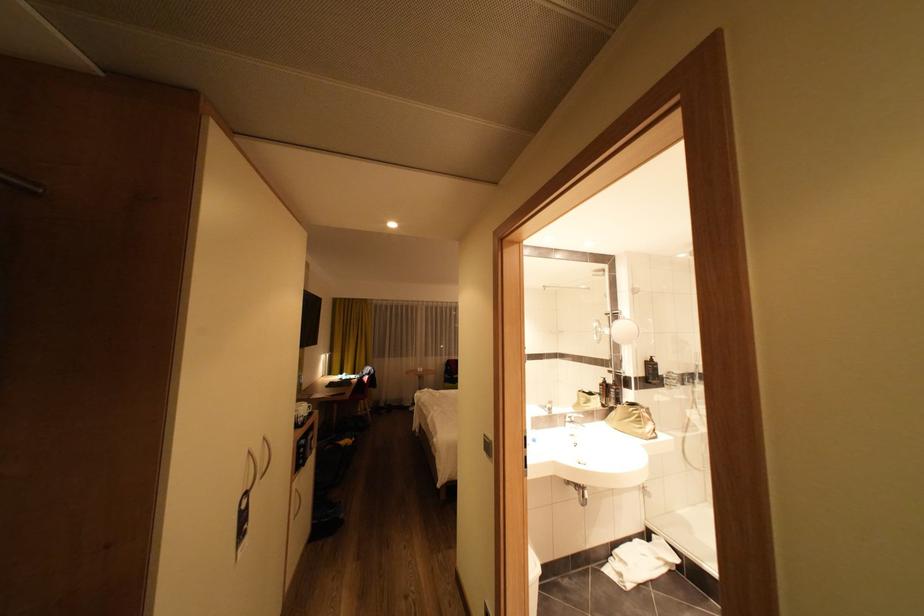
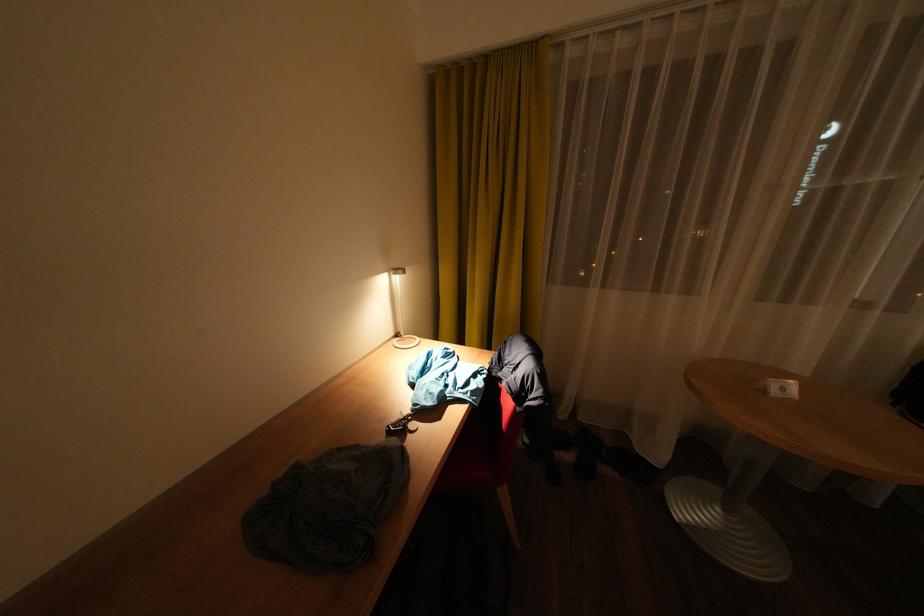
The point at [377,301] is marked in the first image. Where is the corresponding point in the second image?

(544, 47)